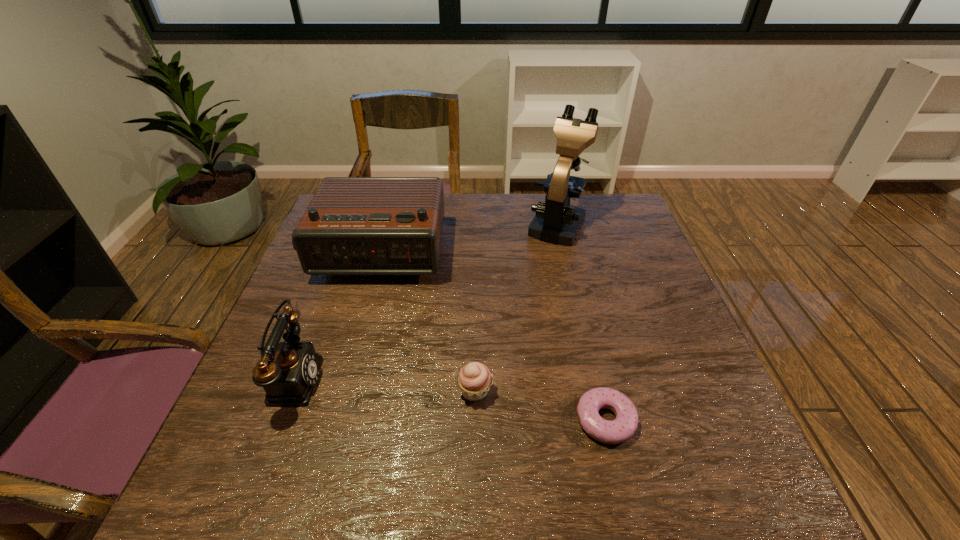
Locate an element on the screen. Image resolution: width=960 pixels, height=540 pixels. microscope is located at coordinates (557, 222).

What are the coordinates of `the second tallest object` in the screenshot? It's located at (353, 225).

I want to click on the third tallest object, so click(288, 379).

Image resolution: width=960 pixels, height=540 pixels. Find the location of `cupcake`. cupcake is located at coordinates (474, 380).

This screenshot has height=540, width=960. In order to click on the third object from left to right in this screenshot , I will do 474,380.

Image resolution: width=960 pixels, height=540 pixels. Identify the location of doughnut. (625, 425).

Image resolution: width=960 pixels, height=540 pixels. I want to click on free spot located on the right of the microscope, so click(616, 223).

Where is `blank space located 0.360m on the tuning display of the radio receiver`? This screenshot has width=960, height=540. blank space located 0.360m on the tuning display of the radio receiver is located at coordinates (334, 406).

At what (x,y) coordinates should I click in order to perform the action: click on vacant space situated 0.340m on the front of the telephone at the rotary dial. Please return your answer as a coordinate pair (x, y). This screenshot has height=540, width=960. Looking at the image, I should click on (482, 379).

At what (x,y) coordinates should I click in order to perform the action: click on vacant area situated 0.190m on the front of the third object from right to left. Please return your answer as a coordinate pair (x, y). The image size is (960, 540). Looking at the image, I should click on click(x=473, y=507).